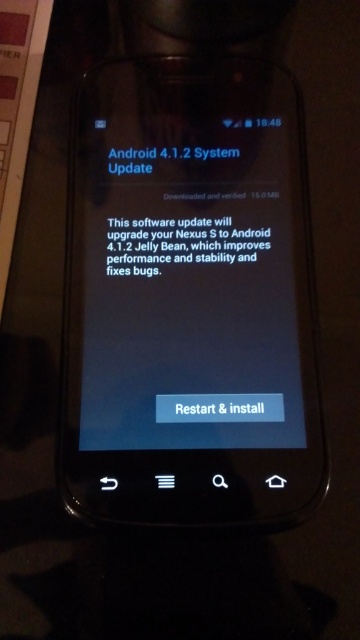
Is point (185, 244) in front of point (174, 161)?

Yes, point (185, 244) is in front of point (174, 161).

This screenshot has width=360, height=640. What are the coordinates of `black matte text at center` in the screenshot? It's located at (178, 243).

Is point (174, 228) more distant than point (192, 154)?

No, it is in front of (192, 154).

Identify the location of black matte text at center. 178,243.

What do you see at coordinates (190, 291) in the screenshot? I see `blue glossy screen at center` at bounding box center [190, 291].

Is point (123, 381) positioned in front of point (132, 250)?

Yes.

Does point (108, 300) come farther from viewer compared to point (195, 228)?

No, it is in front of (195, 228).

This screenshot has height=640, width=360. I want to click on blue glossy screen at center, so click(x=190, y=291).

Between blue glossy screen at center and blue glossy text at upper center, which one has less height?

blue glossy text at upper center is shorter.

Which is more to the left, blue glossy screen at center or blue glossy text at upper center?

Positioned to the left is blue glossy text at upper center.

Between point (194, 300) and point (119, 157), which one is positioned in front?

Point (194, 300)

Locate an element on the screen. This screenshot has height=640, width=360. blue glossy screen at center is located at coordinates (190, 291).